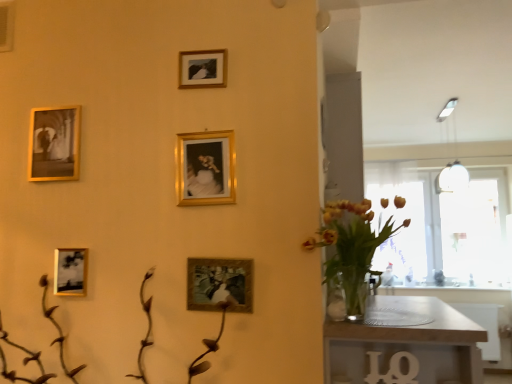
Locate an element on the screen. transparent glass window at right is located at coordinates click(x=443, y=227).

Measure the distance between wooden table at lower right and camera.

4.94 feet.

Where is `matte gold picture frame at lower left, which is counted as the second picture frame, starting from the left`? Image resolution: width=512 pixels, height=384 pixels. matte gold picture frame at lower left, which is counted as the second picture frame, starting from the left is located at coordinates (70, 272).

What do you see at coordinates (205, 168) in the screenshot?
I see `gold metallic picture frame at center, the second picture frame positioned from the right` at bounding box center [205, 168].

In order to face translucent glass vase at right, should I rotate leftwards or rightwards?

It's best to rotate right around 13.993 degrees.

Identify the location of transparent glass door at right. (401, 231).

Is point (60, 275) closer to viewer compared to point (476, 379)?

That is False.

Is matte gold picture frame at lower left, which ranks as the second picture frame in bottom-to-top order, inside the boundaries of wooden table at lower right, or outside?

The correct answer is: outside.

The width and height of the screenshot is (512, 384). I want to click on the 4th picture frame behind the wooden table at lower right, starting your count from the anchor, so click(70, 272).

In the scene shown: From the image's perspective, is transparent glass window at right located above or below translucent glass vase at right?

transparent glass window at right is below translucent glass vase at right.

Based on the photo, would you say transparent glass window at right contains translucent glass vase at right?

No, translucent glass vase at right is not inside transparent glass window at right.

From a real-world perspective, which is physically above, transparent glass window at right or translucent glass vase at right?

In real-world perspective, transparent glass window at right is above.

Consider the image. Considering their positions, is transparent glass window at right located in front of or behind translucent glass vase at right?

transparent glass window at right is positioned farther from the viewer than translucent glass vase at right.

Is matte gold picture frame at lower left, the 4th picture frame when ordered from right to left, smaller than matte gold picture frame at center, which is counted as the 1th picture frame, starting from the bottom?

Yes, matte gold picture frame at lower left, the 4th picture frame when ordered from right to left, is smaller than matte gold picture frame at center, which is counted as the 1th picture frame, starting from the bottom.

Does matte gold picture frame at lower left, which is counted as the second picture frame, starting from the left, have a lesser height compared to matte gold picture frame at center, the 5th picture frame positioned from the top?

Indeed, matte gold picture frame at lower left, which is counted as the second picture frame, starting from the left, has a lesser height compared to matte gold picture frame at center, the 5th picture frame positioned from the top.

Is the surface of matte gold picture frame at lower left, the 4th picture frame when ordered from right to left, in direct contact with matte gold picture frame at center, which is the fifth picture frame from left to right?

matte gold picture frame at lower left, the 4th picture frame when ordered from right to left, and matte gold picture frame at center, which is the fifth picture frame from left to right, are clearly separated.

Is matte gold picture frame at lower left, the 4th picture frame when ordered from right to left, positioned beyond the bounds of matte gold picture frame at center, the 5th picture frame positioned from the top?

matte gold picture frame at lower left, the 4th picture frame when ordered from right to left, lies outside matte gold picture frame at center, the 5th picture frame positioned from the top,'s area.

Does transparent glass door at right touch gold metallic picture frame at center, the 4th picture frame positioned from the left?

There is a gap between transparent glass door at right and gold metallic picture frame at center, the 4th picture frame positioned from the left.

Does transparent glass door at right have a greater width compared to gold metallic picture frame at center, which appears as the 3th picture frame when viewed from the top?

Yes.

Is transparent glass door at right not inside gold metallic picture frame at center, the 4th picture frame positioned from the left?

transparent glass door at right lies outside gold metallic picture frame at center, the 4th picture frame positioned from the left,'s area.

Choose the correct answer: Is translucent glass vase at right inside gold-framed photo at upper left, acting as the 2th picture frame starting from the top, or outside it?

translucent glass vase at right is not enclosed by gold-framed photo at upper left, acting as the 2th picture frame starting from the top.

Considering the relative sizes of translucent glass vase at right and gold-framed photo at upper left, which appears as the fourth picture frame when ordered from the bottom, in the image provided, is translucent glass vase at right shorter than gold-framed photo at upper left, which appears as the fourth picture frame when ordered from the bottom,?

No.

Consider the image. Between translucent glass vase at right and gold-framed photo at upper left, acting as the 2th picture frame starting from the top, which one is positioned in front?

translucent glass vase at right is in front.

Considering the positions of objects translucent glass vase at right and gold-framed photo at upper left, which appears as the fourth picture frame when ordered from the bottom, in the image provided, who is more to the left, translucent glass vase at right or gold-framed photo at upper left, which appears as the fourth picture frame when ordered from the bottom,?

Positioned to the left is gold-framed photo at upper left, which appears as the fourth picture frame when ordered from the bottom.

Is matte gold picture frame at lower left, which is counted as the second picture frame, starting from the left, looking in the opposite direction of transparent glass window at right?

No, matte gold picture frame at lower left, which is counted as the second picture frame, starting from the left,'s orientation is not away from transparent glass window at right.

Is matte gold picture frame at lower left, which ranks as the second picture frame in bottom-to-top order, located outside transparent glass window at right?

Yes.

Is matte gold picture frame at lower left, which is the fourth picture frame in top-to-bottom order, in front of or behind transparent glass window at right in the image?

Clearly, matte gold picture frame at lower left, which is the fourth picture frame in top-to-bottom order, is in front of transparent glass window at right.

Based on the photo, which object is wider, matte gold picture frame at lower left, which is the fourth picture frame in top-to-bottom order, or transparent glass window at right?

transparent glass window at right is wider.

Consider the image. Does gold-framed picture at upper center, which ranks as the 3th picture frame in right-to-left order, come behind gold-framed photo at upper left, which appears as the fourth picture frame when ordered from the bottom?

No.

Is gold-framed picture at upper center, which ranks as the 3th picture frame in right-to-left order, turned away from gold-framed photo at upper left, acting as the 2th picture frame starting from the top?

No, gold-framed picture at upper center, which ranks as the 3th picture frame in right-to-left order, is not facing away from gold-framed photo at upper left, acting as the 2th picture frame starting from the top.

Based on the photo, from a real-world perspective, is gold-framed picture at upper center, marked as the 3th picture frame in a left-to-right arrangement, under gold-framed photo at upper left, acting as the 2th picture frame starting from the top?

Incorrect, from a real-world perspective, gold-framed picture at upper center, marked as the 3th picture frame in a left-to-right arrangement, is higher than gold-framed photo at upper left, acting as the 2th picture frame starting from the top.

Locate an element on the screen. the 2nd picture frame counting from the right of the gold-framed photo at upper left, acting as the 2th picture frame starting from the top is located at coordinates (202, 68).

Where is `table located below the matte gold picture frame at lower left, which is the fourth picture frame in top-to-bottom order (from the image's perspective)`? The width and height of the screenshot is (512, 384). table located below the matte gold picture frame at lower left, which is the fourth picture frame in top-to-bottom order (from the image's perspective) is located at coordinates (406, 347).

Find the location of a particular element. This screenshot has height=384, width=512. floral arrangement below the transparent glass window at right (from a real-world perspective) is located at coordinates (351, 249).

Looking at the image, which one is located closer to transparent glass window at right, matte gold picture frame at center, the 5th picture frame positioned from the top, or translucent glass vase at right?

translucent glass vase at right lies closer to transparent glass window at right than the other object.

From the image, which object appears to be nearer to wooden table at lower right, matte gold picture frame at center, which is the fifth picture frame from left to right, or gold-framed picture at upper center, the 1th picture frame when ordered from top to bottom?

matte gold picture frame at center, which is the fifth picture frame from left to right, is positioned closer to the anchor wooden table at lower right.

Which object lies further to the anchor point transparent glass window at right, transparent glass door at right or gold metallic picture frame at center, the 3th picture frame when ordered from bottom to top?

Among the two, gold metallic picture frame at center, the 3th picture frame when ordered from bottom to top, is located further to transparent glass window at right.

Consider the image. From the image, which object appears to be farther from matte gold picture frame at center, the 5th picture frame positioned from the top, transparent glass door at right or wooden table at lower right?

transparent glass door at right.

When comparing their distances from matte gold picture frame at center, which is counted as the 1th picture frame, starting from the bottom, does gold metallic picture frame at center, the 4th picture frame positioned from the left, or gold-framed picture at upper center, marked as the 3th picture frame in a left-to-right arrangement, seem further?

gold-framed picture at upper center, marked as the 3th picture frame in a left-to-right arrangement, is positioned further to the anchor matte gold picture frame at center, which is counted as the 1th picture frame, starting from the bottom.

Based on their spatial positions, is transparent glass window at right or transparent glass door at right further from translucent glass vase at right?

transparent glass window at right lies further to translucent glass vase at right than the other object.

Looking at the image, which one is located further to gold-framed photo at upper left, acting as the 2th picture frame starting from the top, gold-framed picture at upper center, the 5th picture frame ordered from the bottom, or matte gold picture frame at center, which is counted as the 1th picture frame, starting from the bottom?

matte gold picture frame at center, which is counted as the 1th picture frame, starting from the bottom.

Which object lies nearer to the anchor point gold-framed photo at upper left, acting as the 2th picture frame starting from the top, transparent glass door at right or gold metallic picture frame at center, which appears as the 3th picture frame when viewed from the top?

gold metallic picture frame at center, which appears as the 3th picture frame when viewed from the top, lies closer to gold-framed photo at upper left, acting as the 2th picture frame starting from the top, than the other object.

Where is `glass door between translucent glass vase at right and transparent glass window at right along the z-axis`? This screenshot has height=384, width=512. glass door between translucent glass vase at right and transparent glass window at right along the z-axis is located at coordinates (401, 231).

I want to click on picture frame positioned between matte gold picture frame at lower left, the 4th picture frame when ordered from right to left, and transparent glass window at right from near to far, so click(x=54, y=144).

The height and width of the screenshot is (384, 512). Identify the location of picture frame between gold metallic picture frame at center, the second picture frame positioned from the right, and wooden table at lower right, in the horizontal direction. (219, 284).

Locate an element on the screen. floral arrangement between gold-framed picture at upper center, marked as the 3th picture frame in a left-to-right arrangement, and wooden table at lower right, in the vertical direction is located at coordinates point(351,249).